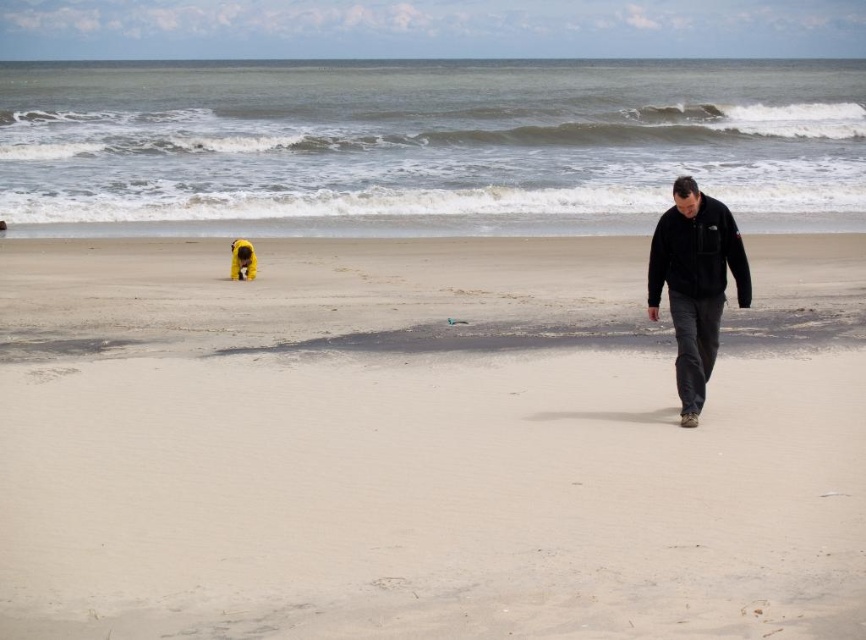
Between smooth sand at center and black fleece jacket at right, which one is positioned lower?

smooth sand at center

Does smooth sand at center lie behind black fleece jacket at right?

No, smooth sand at center is closer to the viewer.

I want to click on smooth sand at center, so click(x=423, y=444).

Consider the image. Does black fleece jacket at right appear on the left side of yellow fur dog at left?

In fact, black fleece jacket at right is to the right of yellow fur dog at left.

The width and height of the screenshot is (866, 640). I want to click on black fleece jacket at right, so click(695, 284).

Is smooth sand at center thinner than yellow fur dog at left?

Incorrect, smooth sand at center's width is not less than yellow fur dog at left's.

Which is more to the right, smooth sand at center or yellow fur dog at left?

From the viewer's perspective, smooth sand at center appears more on the right side.

What do you see at coordinates (423, 444) in the screenshot? The width and height of the screenshot is (866, 640). I see `smooth sand at center` at bounding box center [423, 444].

Find the location of a particular element. This screenshot has width=866, height=640. smooth sand at center is located at coordinates (423, 444).